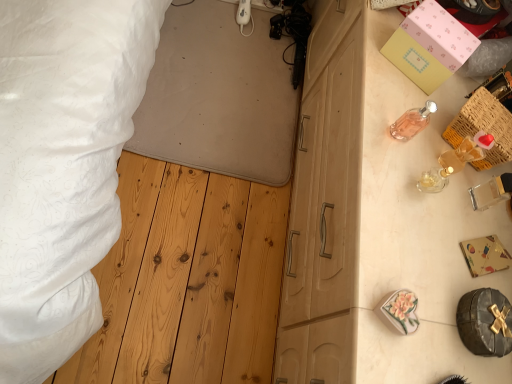
Question: From the image's perspective, would you say pink glass perfume at upper right is shown under white textured bed at upper left?

Choices:
 (A) yes
 (B) no

Answer: (A)

Question: Is pink glass perfume at upper right oriented towards white textured bed at upper left?

Choices:
 (A) yes
 (B) no

Answer: (B)

Question: Is pink glass perfume at upper right smaller than white textured bed at upper left?

Choices:
 (A) yes
 (B) no

Answer: (A)

Question: Is pink glass perfume at upper right thinner than white textured bed at upper left?

Choices:
 (A) no
 (B) yes

Answer: (B)

Question: Is pink glass perfume at upper right to the right of white textured bed at upper left from the viewer's perspective?

Choices:
 (A) yes
 (B) no

Answer: (A)

Question: Considering the positions of woven wood crate at upper right and pink glass perfume at upper right in the image, is woven wood crate at upper right taller or shorter than pink glass perfume at upper right?

Choices:
 (A) tall
 (B) short

Answer: (B)

Question: Is woven wood crate at upper right in front of or behind pink glass perfume at upper right in the image?

Choices:
 (A) front
 (B) behind

Answer: (B)

Question: Does point (505, 142) appear closer or farther from the camera than point (417, 129)?

Choices:
 (A) farther
 (B) closer

Answer: (B)

Question: Considering the positions of woven wood crate at upper right and pink glass perfume at upper right in the image, is woven wood crate at upper right bigger or smaller than pink glass perfume at upper right?

Choices:
 (A) big
 (B) small

Answer: (A)

Question: Is point (455, 56) closer or farther from the camera than point (493, 251)?

Choices:
 (A) farther
 (B) closer

Answer: (A)

Question: Is pink matte box at upper right, acting as the 1th box starting from the top, wider or thinner than gold foil gift box at right, positioned as the first box in front-to-back order?

Choices:
 (A) wide
 (B) thin

Answer: (A)

Question: From a real-world perspective, is pink matte box at upper right, the 1th box when ordered from back to front, physically located above or below gold foil gift box at right, marked as the first box in a bottom-to-top arrangement?

Choices:
 (A) above
 (B) below

Answer: (A)

Question: Considering their positions, is pink matte box at upper right, the second box in the front-to-back sequence, located in front of or behind gold foil gift box at right, which ranks as the second box in top-to-bottom order?

Choices:
 (A) behind
 (B) front

Answer: (A)

Question: Is pink matte box at upper right, the 1th box when ordered from back to front, wider or thinner than white textured bed at upper left?

Choices:
 (A) wide
 (B) thin

Answer: (B)

Question: Is point (465, 41) positioned closer to the camera than point (4, 3)?

Choices:
 (A) farther
 (B) closer

Answer: (A)